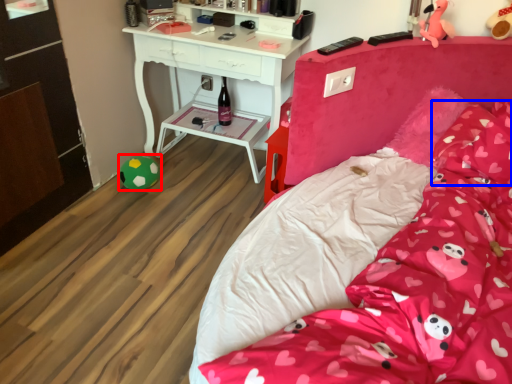
Question: Among these objects, which one is nearest to the camera, toy (highlighted by a red box) or pillow (highlighted by a blue box)?

Choices:
 (A) toy
 (B) pillow

Answer: (B)